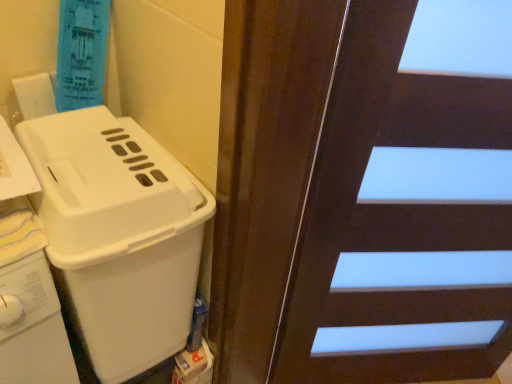
Question: From the image's perspective, is white plastic basket at left located above or below dark wood door at upper right?

Choices:
 (A) above
 (B) below

Answer: (A)

Question: Relative to dark wood door at upper right, is white plastic basket at left in front or behind?

Choices:
 (A) front
 (B) behind

Answer: (B)

Question: Looking at the image, does white plastic basket at left seem bigger or smaller compared to dark wood door at upper right?

Choices:
 (A) big
 (B) small

Answer: (B)

Question: Is dark wood door at upper right bigger or smaller than white plastic basket at left?

Choices:
 (A) big
 (B) small

Answer: (A)

Question: Would you say dark wood door at upper right is inside or outside white plastic basket at left?

Choices:
 (A) inside
 (B) outside

Answer: (B)

Question: Would you say dark wood door at upper right is to the left or to the right of white plastic basket at left in the picture?

Choices:
 (A) right
 (B) left

Answer: (A)

Question: Relative to white plastic basket at left, is dark wood door at upper right in front or behind?

Choices:
 (A) front
 (B) behind

Answer: (A)